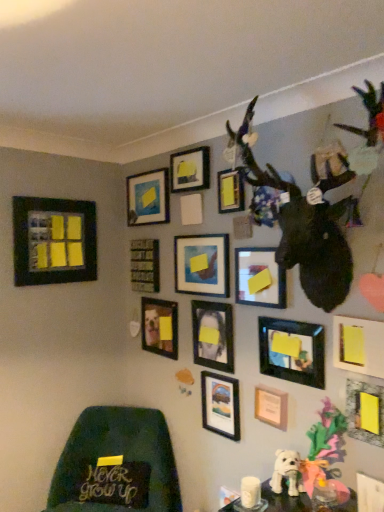
What do you see at coordinates (369, 493) in the screenshot? I see `wooden picture frame at lower right, the 14th picture frame when ordered from left to right` at bounding box center [369, 493].

The width and height of the screenshot is (384, 512). I want to click on wooden picture frame at lower right, acting as the 2th picture frame starting from the right, so click(369, 493).

Measure the distance between point [150,341] and camera.

7.96 feet.

How much space does yellow matte picture frame at lower right, arranged as the 15th picture frame when viewed from the left, occupy horizontally?

1.48 inches.

Where is `matte black picture frame at upper center, placed as the third picture frame when sorted from left to right`? The width and height of the screenshot is (384, 512). matte black picture frame at upper center, placed as the third picture frame when sorted from left to right is located at coordinates (148, 198).

Between point (293, 204) and point (376, 501), which one is positioned in front?

The point (376, 501) is more forward.

Looking at this image, in the image, is shiny black antlers at upper right positioned in front of or behind wooden picture frame at lower right, acting as the 2th picture frame starting from the right?

shiny black antlers at upper right is positioned closer to the viewer than wooden picture frame at lower right, acting as the 2th picture frame starting from the right.

Is shiny black antlers at upper right taller than wooden picture frame at lower right, the 14th picture frame when ordered from left to right?

Indeed, shiny black antlers at upper right has a greater height compared to wooden picture frame at lower right, the 14th picture frame when ordered from left to right.

From a real-world perspective, between shiny black antlers at upper right and wooden picture frame at lower right, acting as the 2th picture frame starting from the right, who is vertically lower?

wooden picture frame at lower right, acting as the 2th picture frame starting from the right, from a real-world perspective.

In the scene shown: Is black matte picture frame at center, the 14th picture frame when ordered from right to left, taller or shorter than matte black picture frame at upper left, the fifteenth picture frame viewed from the right?

Considering their sizes, black matte picture frame at center, the 14th picture frame when ordered from right to left, has less height than matte black picture frame at upper left, the fifteenth picture frame viewed from the right.

Between black matte picture frame at center, the 2th picture frame viewed from the left, and matte black picture frame at upper left, which is counted as the first picture frame, starting from the left, which one appears on the left side from the viewer's perspective?

matte black picture frame at upper left, which is counted as the first picture frame, starting from the left, is more to the left.

Which is in front, point (153, 286) or point (27, 201)?

The point (27, 201) is more forward.

Which object is further away from the camera, black matte picture frame at center, the 2th picture frame viewed from the left, or matte black picture frame at upper left, which is counted as the first picture frame, starting from the left?

black matte picture frame at center, the 2th picture frame viewed from the left, is behind.

Is matte blue painting at center, the sixth picture frame viewed from the left, positioned before shiny black antlers at upper right?

No.

Considering the positions of objects matte blue painting at center, the 10th picture frame viewed from the right, and shiny black antlers at upper right in the image provided, who is more to the right, matte blue painting at center, the 10th picture frame viewed from the right, or shiny black antlers at upper right?

shiny black antlers at upper right.

Are matte blue painting at center, the sixth picture frame viewed from the left, and shiny black antlers at upper right making contact?

No, matte blue painting at center, the sixth picture frame viewed from the left, is not in contact with shiny black antlers at upper right.

Who is smaller, matte black fabric at lower left or matte black picture frame at center, the eighth picture frame positioned from the left?

matte black picture frame at center, the eighth picture frame positioned from the left.

Would you say matte black fabric at lower left is outside matte black picture frame at center, marked as the eighth picture frame in a right-to-left arrangement?

Indeed, matte black fabric at lower left is completely outside matte black picture frame at center, marked as the eighth picture frame in a right-to-left arrangement.

Find the location of a particular element. picture frame that is the 4th one when counting forward from the matte black fabric at lower left is located at coordinates (220, 405).

Could you tell me if matte black frame at upper center, which appears as the eleventh picture frame when viewed from the right, is facing matte black picture frame at upper center, which appears as the thirteenth picture frame when viewed from the right?

No.

Is matte black frame at upper center, the fifth picture frame viewed from the left, at the right side of matte black picture frame at upper center, placed as the third picture frame when sorted from left to right?

Correct, you'll find matte black frame at upper center, the fifth picture frame viewed from the left, to the right of matte black picture frame at upper center, placed as the third picture frame when sorted from left to right.

How many degrees apart are the facing directions of matte black frame at upper center, which appears as the eleventh picture frame when viewed from the right, and matte black picture frame at upper center, placed as the third picture frame when sorted from left to right?

The angle between the facing direction of matte black frame at upper center, which appears as the eleventh picture frame when viewed from the right, and the facing direction of matte black picture frame at upper center, placed as the third picture frame when sorted from left to right, is 0.194 degrees.

Which of these two, matte black frame at upper center, the fifth picture frame viewed from the left, or matte black picture frame at upper center, which appears as the thirteenth picture frame when viewed from the right, is smaller?

matte black frame at upper center, the fifth picture frame viewed from the left, is smaller.

Which of these two, dark green fabric chair at lower left or matte black photo frame at center, positioned as the 9th picture frame in right-to-left order, is bigger?

Bigger between the two is dark green fabric chair at lower left.

Is dark green fabric chair at lower left closer to camera compared to matte black photo frame at center, the 7th picture frame in the left-to-right sequence?

Yes, dark green fabric chair at lower left is in front of matte black photo frame at center, the 7th picture frame in the left-to-right sequence.

Considering the sizes of dark green fabric chair at lower left and matte black photo frame at center, the 7th picture frame in the left-to-right sequence, in the image, is dark green fabric chair at lower left taller or shorter than matte black photo frame at center, the 7th picture frame in the left-to-right sequence,?

dark green fabric chair at lower left is taller than matte black photo frame at center, the 7th picture frame in the left-to-right sequence.

From the image's perspective, between dark green fabric chair at lower left and matte black photo frame at center, positioned as the 9th picture frame in right-to-left order, who is located below?

dark green fabric chair at lower left appears lower in the image.

Is white plush dog at lower center positioned far away from matte black photo frame at center, the 7th picture frame in the left-to-right sequence?

Actually, white plush dog at lower center and matte black photo frame at center, the 7th picture frame in the left-to-right sequence, are a little close together.

How many degrees apart are the facing directions of white plush dog at lower center and matte black photo frame at center, the 7th picture frame in the left-to-right sequence?

They differ by 43.5 degrees in their facing directions.

Which object is positioned more to the left, white plush dog at lower center or matte black photo frame at center, the 7th picture frame in the left-to-right sequence?

matte black photo frame at center, the 7th picture frame in the left-to-right sequence.

Considering the sizes of objects white plush dog at lower center and matte black photo frame at center, positioned as the 9th picture frame in right-to-left order, in the image provided, who is taller, white plush dog at lower center or matte black photo frame at center, positioned as the 9th picture frame in right-to-left order,?

With more height is matte black photo frame at center, positioned as the 9th picture frame in right-to-left order.

Locate an element on the screen. The height and width of the screenshot is (512, 384). the 2nd picture frame counting from the right of the shiny black antlers at upper right is located at coordinates (369, 493).

From the black matte picture frame at center, the 2th picture frame viewed from the left, count 3rd picture frames forward and point to it. Please provide its 2D coordinates.

[(53, 241)]

When comparing their distances from wooden picture frame at lower right, acting as the 2th picture frame starting from the right, does dark green fabric chair at lower left or matte blue painting at center, the 10th picture frame viewed from the right, seem further?

Based on the image, dark green fabric chair at lower left appears to be further to wooden picture frame at lower right, acting as the 2th picture frame starting from the right.

Based on their spatial positions, is matte black frame at upper center, the fifth picture frame viewed from the left, or matte black picture frame at upper center, the 7th picture frame positioned from the right, closer to wooden picture frame at lower right, the 14th picture frame when ordered from left to right?

matte black picture frame at upper center, the 7th picture frame positioned from the right, is closer to wooden picture frame at lower right, the 14th picture frame when ordered from left to right.

Which object lies further to the anchor point matte black picture frame at upper center, which appears as the thirteenth picture frame when viewed from the right, matte black picture frame at lower right, the fourth picture frame viewed from the right, or matte black picture frame at center, the tenth picture frame from the left?

The object further to matte black picture frame at upper center, which appears as the thirteenth picture frame when viewed from the right, is matte black picture frame at lower right, the fourth picture frame viewed from the right.

Which object lies further to the anchor point matte black picture frame at center, the tenth picture frame from the left, matte black fabric at lower left or white plush dog at lower center?

The object further to matte black picture frame at center, the tenth picture frame from the left, is matte black fabric at lower left.

Estimate the real-world distances between objects in this image. Which object is closer to matte black photo frame at center, the 7th picture frame in the left-to-right sequence, matte black fabric at lower left or matte black picture frame at lower right, the eleventh picture frame viewed from the left?

The object closer to matte black photo frame at center, the 7th picture frame in the left-to-right sequence, is matte black picture frame at lower right, the eleventh picture frame viewed from the left.

Looking at the image, which one is located further to matte black fabric at lower left, matte black picture frame at lower right, the fourth picture frame viewed from the right, or black matte picture frame at center, the 14th picture frame when ordered from right to left?

matte black picture frame at lower right, the fourth picture frame viewed from the right, lies further to matte black fabric at lower left than the other object.

Estimate the real-world distances between objects in this image. Which object is closer to dark green fabric chair at lower left, wooden picture frame at lower right, acting as the 2th picture frame starting from the right, or matte blue painting at center, the sixth picture frame viewed from the left?

The object closer to dark green fabric chair at lower left is matte blue painting at center, the sixth picture frame viewed from the left.

When comparing their distances from matte black picture frame at lower right, which is the fifth picture frame from right to left, does shiny black antlers at upper right or black matte picture frame at center, the 2th picture frame viewed from the left, seem further?

black matte picture frame at center, the 2th picture frame viewed from the left.

This screenshot has height=512, width=384. Find the location of `toy between matte black picture frame at upper left, which is counted as the first picture frame, starting from the left, and dark green fabric chair at lower left, in the vertical direction`. toy between matte black picture frame at upper left, which is counted as the first picture frame, starting from the left, and dark green fabric chair at lower left, in the vertical direction is located at coordinates (287, 472).

Identify the location of toy between matte black picture frame at upper center, which appears as the thirteenth picture frame when viewed from the right, and dark green fabric chair at lower left in the up-down direction. Image resolution: width=384 pixels, height=512 pixels. (287, 472).

Locate an element on the screen. toy between matte black picture frame at upper center, arranged as the 9th picture frame when viewed from the left, and dark green fabric chair at lower left in the up-down direction is located at coordinates (287, 472).

This screenshot has width=384, height=512. Identify the location of toy that lies between matte black frame at upper center, which appears as the eleventh picture frame when viewed from the right, and dark green fabric chair at lower left from top to bottom. (287, 472).